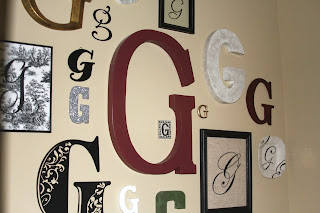
Where is `wall`? The height and width of the screenshot is (213, 320). wall is located at coordinates (218, 15), (297, 25).